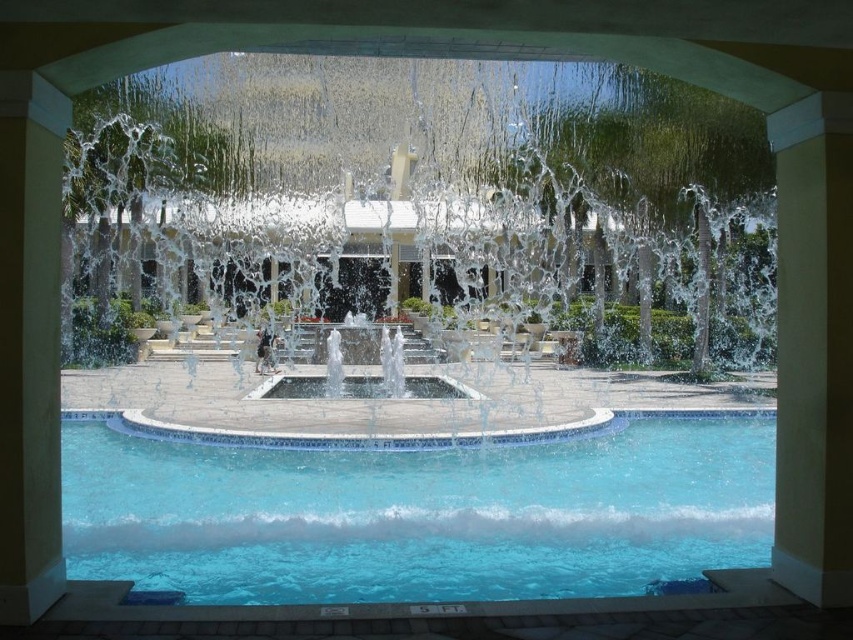
You are planning to install a new lighting system for the clear glass water at center and the clear glass swimming pool at lower center. To ensure proper installation, you need to know which object is taller. Can you determine which one is taller?

The clear glass water at center is much taller than the clear glass swimming pool at lower center according to the description, so the clear glass water at center is the taller one.